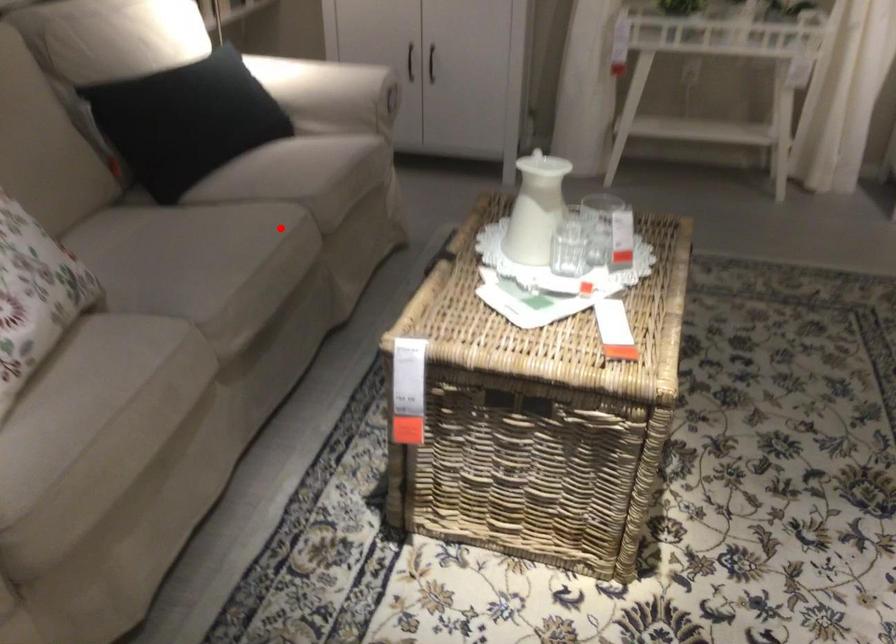
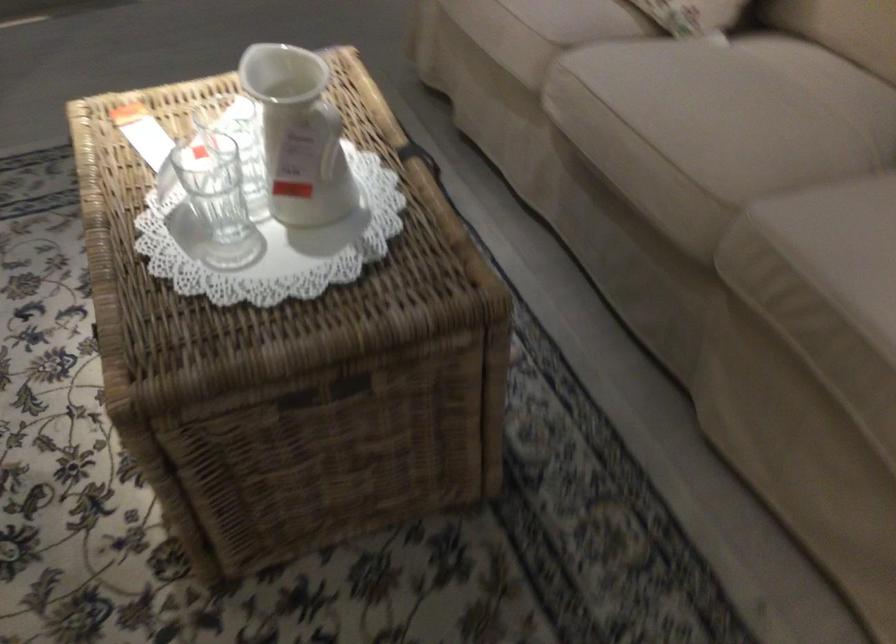
Where in the second image is the point corresponding to the highlighted location from the first image?

(704, 167)